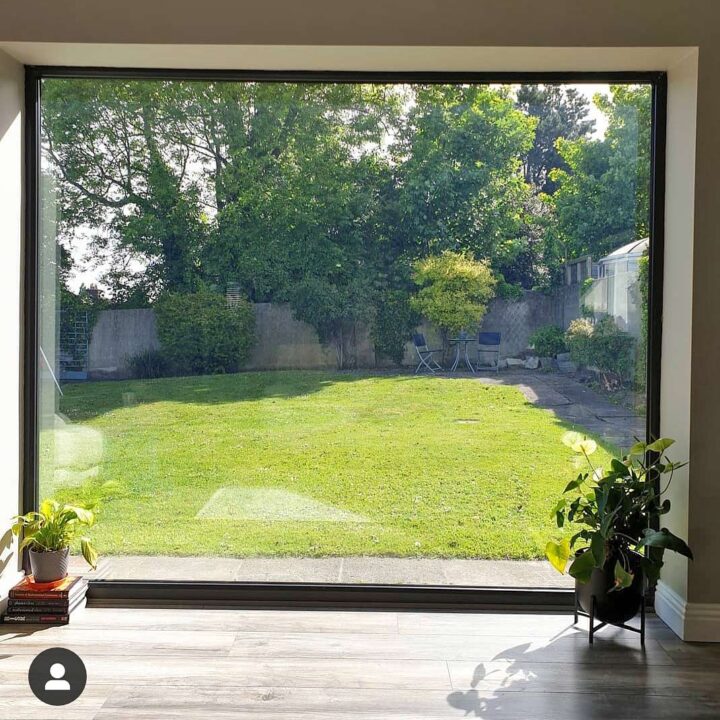
Locate an element on the screen. flower pots is located at coordinates (45, 559), (603, 603).